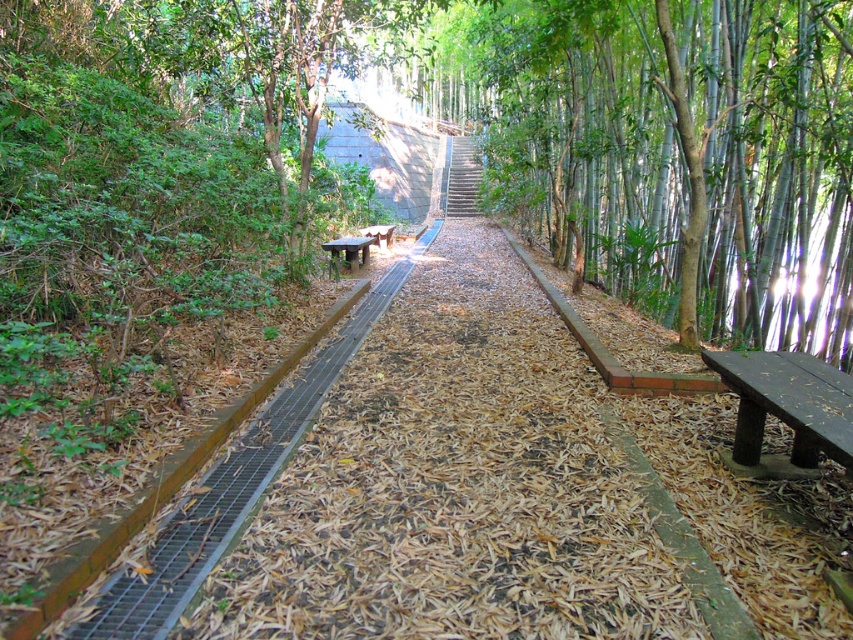
You are standing at the entrance of the forest path and see the dark brown wooden bench at right. If you walk straight ahead along the path, will you approach the bench or move away from it?

Since the dark brown wooden bench at right is located at point (787, 403), which is further along the path, walking straight ahead will bring you closer to the bench. Therefore, you will approach the bench.

You are a park visitor carrying a picnic basket and need to choose a bench to rest. The dark brown wooden bench at right and the brown wooden bench at center are both available. Which bench would be more suitable for placing your picnic basket?

The brown wooden bench at center is larger, so it would be more suitable for placing your picnic basket as it provides more space.

You are a hiker carrying a heavy backpack and want to reach the smooth concrete stairs at center. If your maximum comfortable walking distance is 15 meters, can you comfortably reach the stairs without overexerting yourself?

The smooth concrete stairs at center is 15.15 meters away, which is slightly beyond your 15 meter limit. You may need to take short breaks to avoid overexertion.